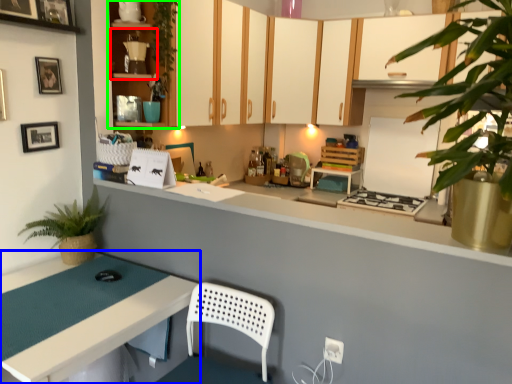
Question: Which object is the farthest from shelf (highlighted by a red box)? Choose among these: table (highlighted by a blue box) or cabinetry (highlighted by a green box).

Choices:
 (A) table
 (B) cabinetry

Answer: (A)